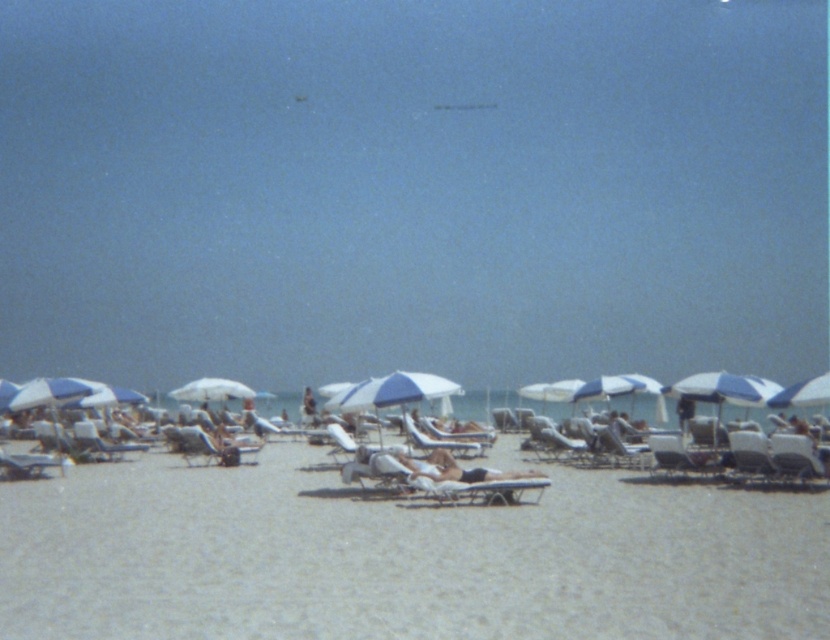
You are standing at the origin point of the coordinate system where the beach scene is mapped. The white plastic chair at center is placed at coordinate point 0.703, 0.748. If you want to move towards the chair, in which direction should you head?

The white plastic chair at center is located at coordinate point (619, 449). Since the coordinate system typically has the origin at the bottom left corner, moving towards higher x and y values would mean heading northeast. Therefore, you should head northeast to reach the white plastic chair at center.

You are planning to set up a beach umbrella that requires a minimum of 1.2 meters of space between the edge of the umbrella and any nearby chairs. You have two chairs available for placement under the umbrella. The chairs are the white plastic chair at center and the matte white lounge chair at center. Which chair should you choose to ensure the umbrella has enough space?

The white plastic chair at center has a lesser width compared to the matte white lounge chair at center, so choosing the white plastic chair at center would allow more space around the umbrella, ensuring the required 1.2 meters of clearance.

You are standing on the beige sand at lower center and want to place a small beach ball on the metallic silver lounge chair at center. Considering their heights, will the ball roll off the chair onto the sand?

The beige sand at lower center is lower in height than the metallic silver lounge chair at center, so the beach ball placed on the metallic silver lounge chair at center will not roll off onto the beige sand at lower center due to the chair being higher.